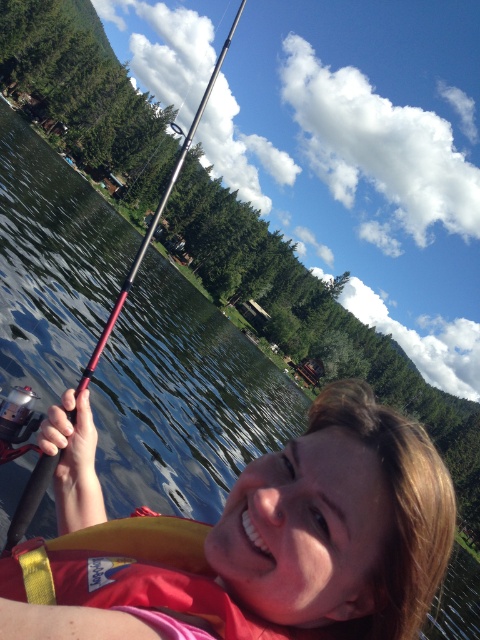
You are a lifeguard in a boat and need to locate the yellow fabric life jacket at lower center. According to the coordinates provided, where should you look?

The yellow fabric life jacket at lower center is located at point (x=135, y=576).

You are a safety inspector checking the water safety equipment. You see the matte yellow life vest at lower center and the yellow fabric life jacket at lower center. Which one is taller?

The matte yellow life vest at lower center is taller than the yellow fabric life jacket at lower center according to the description.

You are a photographer trying to capture the person in the scene. You notice two life vests at the lower center. Which one is nearer to you, the matte yellow life vest at lower center or the yellow fabric life jacket at lower center?

The matte yellow life vest at lower center is closer to the viewer than the yellow fabric life jacket at lower center.